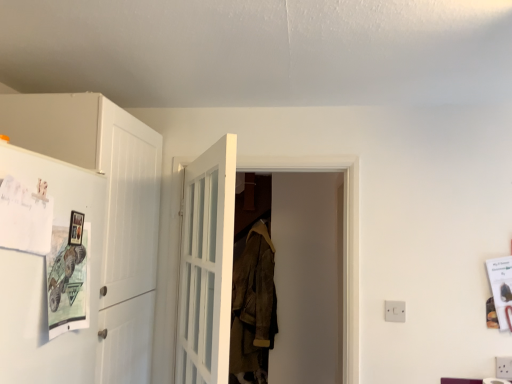
Question: From the image's perspective, is white plastic electric outlet at lower right positioned above or below white matte refrigerator at left?

Choices:
 (A) below
 (B) above

Answer: (A)

Question: From a real-world perspective, is white plastic electric outlet at lower right physically located above or below white matte refrigerator at left?

Choices:
 (A) above
 (B) below

Answer: (B)

Question: Based on their relative distances, which object is nearer to the leather jacket at center?

Choices:
 (A) white matte refrigerator at left
 (B) white glass door at center, the first door positioned from the front
 (C) white plastic electric outlet at lower right
 (D) white wooden door at center, the 1th door in the back-to-front sequence

Answer: (D)

Question: Which is nearer to the white matte refrigerator at left?

Choices:
 (A) leather jacket at center
 (B) white wooden door at center, the 1th door in the back-to-front sequence
 (C) white glass door at center, the 2th door viewed from the back
 (D) white plastic electric outlet at lower right

Answer: (C)